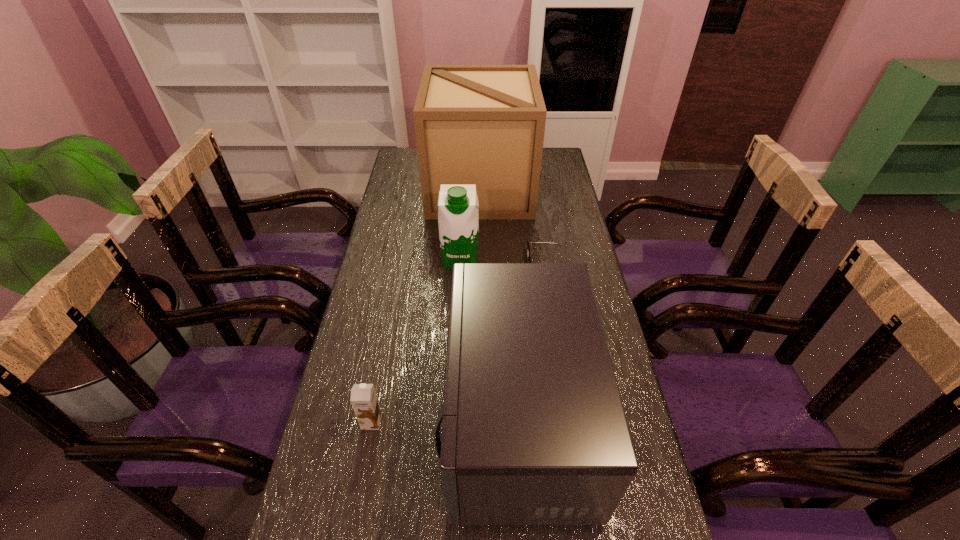
Locate an element on the screen. The image size is (960, 540). the tallest object is located at coordinates (483, 125).

Where is `box`? box is located at coordinates (483, 125).

Identify the location of soya milk. point(458,216).

Identify the location of microwave oven. This screenshot has height=540, width=960. (534, 432).

Where is `the leftmost object`? the leftmost object is located at coordinates (364, 400).

Find the location of `chocolate milk`. chocolate milk is located at coordinates (364, 400).

Locate an element on the screen. Image resolution: width=960 pixels, height=540 pixels. the shortest object is located at coordinates (528, 250).

Locate an element on the screen. The height and width of the screenshot is (540, 960). vacant space located on the reinforced sides of the farthest object is located at coordinates (553, 189).

You are a GUI agent. You are given a task and a screenshot of the screen. Output one action in this format:
    pyautogui.click(x=<x>, y=<y>)
    Task: Click on the free space located on the front-facing side of the soya milk
    The height and width of the screenshot is (540, 960).
    Given the screenshot: What is the action you would take?
    pyautogui.click(x=459, y=285)

Image resolution: width=960 pixels, height=540 pixels. Find the location of `vacant region located on the front-facing side of the microwave oven`. vacant region located on the front-facing side of the microwave oven is located at coordinates (416, 418).